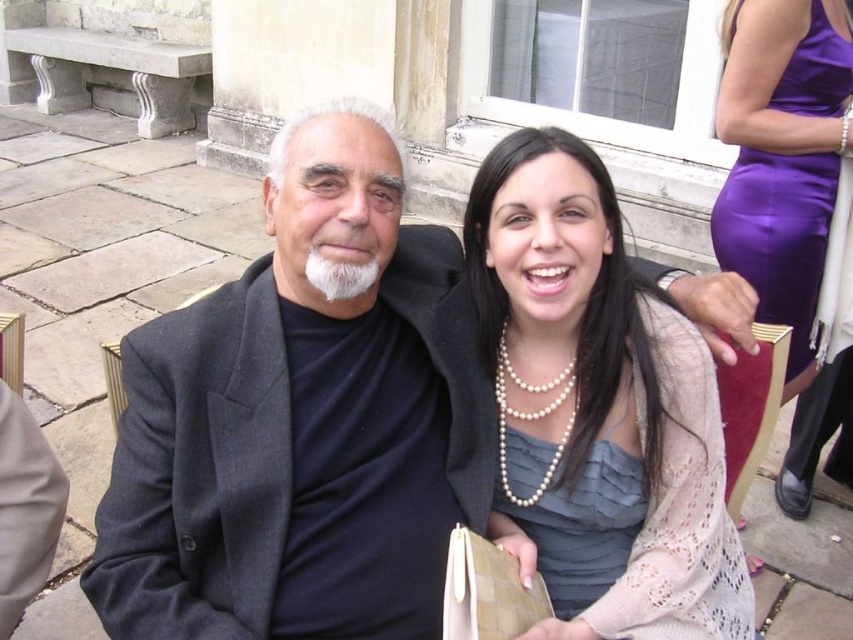
Question: Estimate the real-world distances between objects in this image. Which object is farther from the gray satin dress at center?

Choices:
 (A) pearl necklace at center
 (B) purple satin dress at right
 (C) dark gray suit at center

Answer: (B)

Question: Is dark gray suit at center smaller than pearl necklace at center?

Choices:
 (A) yes
 (B) no

Answer: (B)

Question: Which point is closer to the camera?

Choices:
 (A) purple satin dress at right
 (B) gray satin dress at center
 (C) dark gray suit at center
 (D) pearl necklace at center

Answer: (D)

Question: Which object is closer to the camera taking this photo?

Choices:
 (A) gray satin dress at center
 (B) dark gray suit at center
 (C) pearl necklace at center
 (D) purple satin dress at right

Answer: (C)

Question: Is pearl necklace at center to the right of purple satin dress at right from the viewer's perspective?

Choices:
 (A) no
 (B) yes

Answer: (A)

Question: Can you confirm if dark gray suit at center is thinner than gray satin dress at center?

Choices:
 (A) no
 (B) yes

Answer: (A)